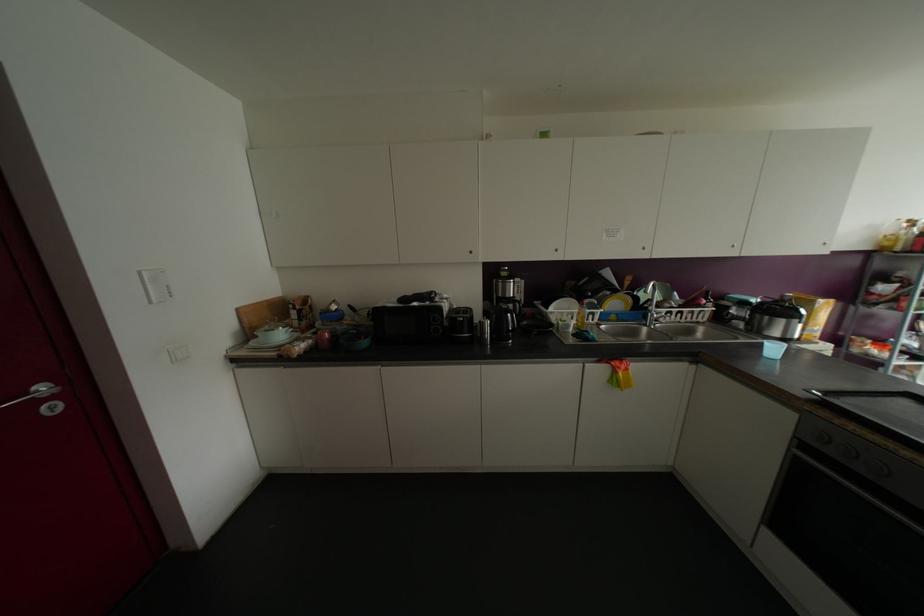
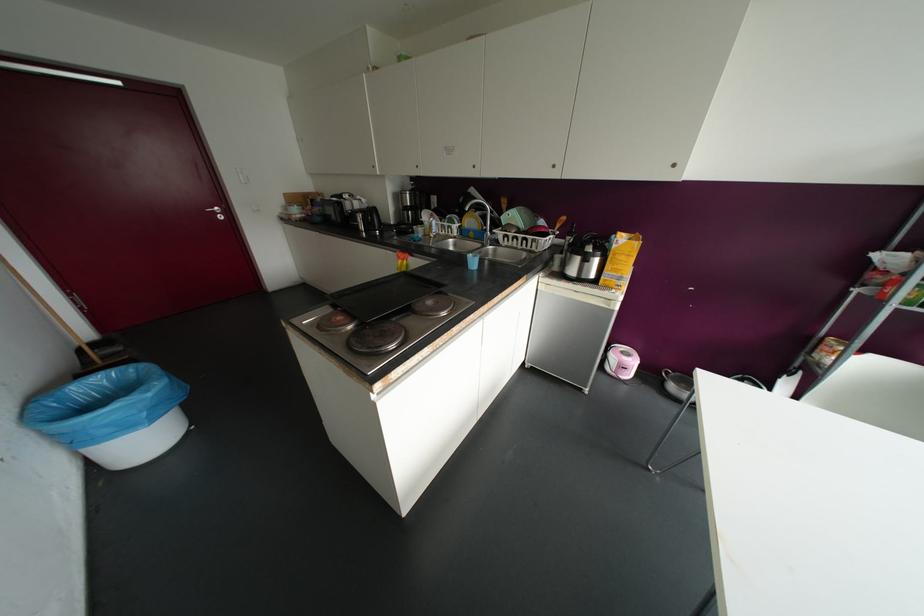
Locate, in the second image, the point that corresponds to [642,248] in the first image.

(473, 166)